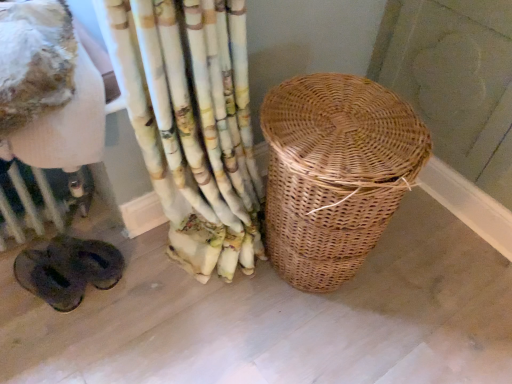
Question: Does white painted radiator at lower left have a larger size compared to woven brown basket at center?

Choices:
 (A) no
 (B) yes

Answer: (A)

Question: Is white painted radiator at lower left aimed at woven brown basket at center?

Choices:
 (A) no
 (B) yes

Answer: (A)

Question: Considering the relative sizes of white painted radiator at lower left and woven brown basket at center in the image provided, is white painted radiator at lower left thinner than woven brown basket at center?

Choices:
 (A) no
 (B) yes

Answer: (B)

Question: Is white painted radiator at lower left oriented away from woven brown basket at center?

Choices:
 (A) no
 (B) yes

Answer: (A)

Question: From a real-world perspective, is white painted radiator at lower left under woven brown basket at center?

Choices:
 (A) yes
 (B) no

Answer: (A)

Question: From a real-world perspective, is white painted radiator at lower left physically above woven brown basket at center?

Choices:
 (A) no
 (B) yes

Answer: (A)

Question: From the image's perspective, is woven brown basket at center on top of white painted radiator at lower left?

Choices:
 (A) no
 (B) yes

Answer: (B)

Question: Is woven brown basket at center turned away from white painted radiator at lower left?

Choices:
 (A) yes
 (B) no

Answer: (B)

Question: Does woven brown basket at center lie behind white painted radiator at lower left?

Choices:
 (A) yes
 (B) no

Answer: (B)

Question: Is woven brown basket at center at the right side of white painted radiator at lower left?

Choices:
 (A) yes
 (B) no

Answer: (A)

Question: Does woven brown basket at center come in front of white painted radiator at lower left?

Choices:
 (A) yes
 (B) no

Answer: (A)

Question: Is woven brown basket at center smaller than white painted radiator at lower left?

Choices:
 (A) yes
 (B) no

Answer: (B)

Question: Looking at the image, does woven brown basket at center seem bigger or smaller compared to white painted radiator at lower left?

Choices:
 (A) small
 (B) big

Answer: (B)